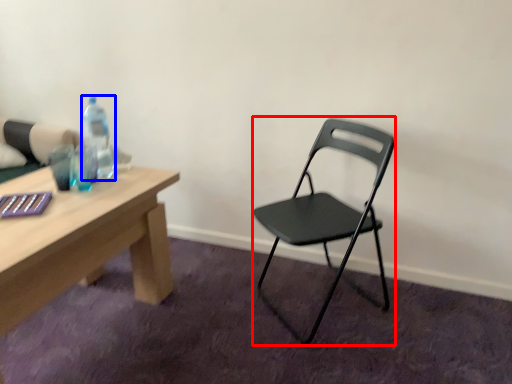
Question: Which object is closer to the camera taking this photo, chair (highlighted by a red box) or bottle (highlighted by a blue box)?

Choices:
 (A) chair
 (B) bottle

Answer: (A)